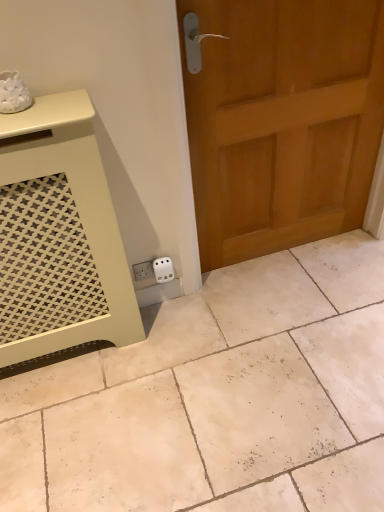
Question: Is wooden door at right inside the boundaries of matte cream vanity at lower left, or outside?

Choices:
 (A) inside
 (B) outside

Answer: (B)

Question: Considering the relative positions of wooden door at right and matte cream vanity at lower left in the image provided, is wooden door at right to the left or to the right of matte cream vanity at lower left?

Choices:
 (A) left
 (B) right

Answer: (B)

Question: Estimate the real-world distances between objects in this image. Which object is farther from the matte cream vanity at lower left?

Choices:
 (A) white plastic electric outlet at lower center
 (B) white matte tile at lower left
 (C) wooden door at right

Answer: (C)

Question: Estimate the real-world distances between objects in this image. Which object is closer to the matte cream vanity at lower left?

Choices:
 (A) white matte tile at lower left
 (B) white plastic electric outlet at lower center
 (C) wooden door at right

Answer: (B)